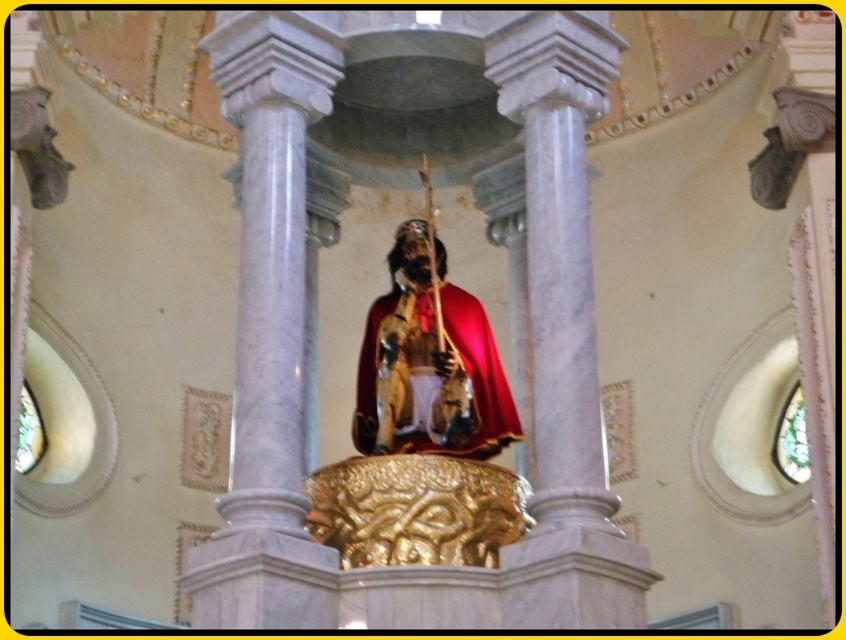
You are an art conservator assessing the space between the gold polished statue at center and the shiny gold robe at center. Which object is taller?

The gold polished statue at center is taller than the shiny gold robe at center.